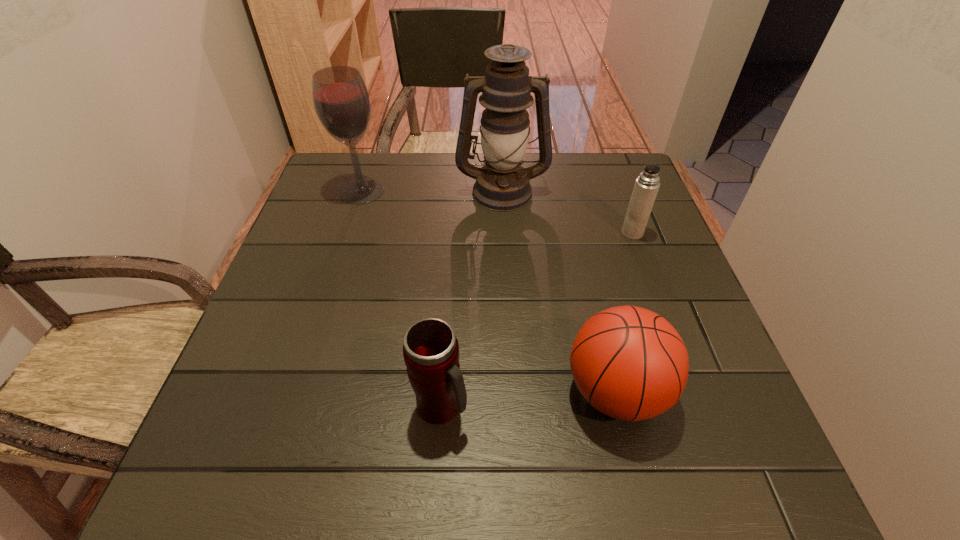
Locate an element on the screen. The height and width of the screenshot is (540, 960). oil lamp is located at coordinates (x=502, y=184).

In order to click on alcohol in this screenshot , I will do `click(341, 100)`.

The height and width of the screenshot is (540, 960). Find the location of `the leftmost object`. the leftmost object is located at coordinates (341, 100).

Identify the location of the left thermos bottle. (431, 351).

Where is `the right thermos bottle`? This screenshot has width=960, height=540. the right thermos bottle is located at coordinates tap(646, 187).

Identify the location of the farther thermos bottle. The width and height of the screenshot is (960, 540). (646, 187).

You are a GUI agent. You are given a task and a screenshot of the screen. Output one action in this format:
    pyautogui.click(x=<x>, y=<y>)
    Task: Click on the basketball
    
    Given the screenshot: What is the action you would take?
    pyautogui.click(x=629, y=363)

Image resolution: width=960 pixels, height=540 pixels. Find the location of `vacant space located on the left of the oil lamp`. vacant space located on the left of the oil lamp is located at coordinates [395, 191].

Locate an element on the screen. Image resolution: width=960 pixels, height=540 pixels. free spot located 0.300m on the right of the fourth shortest object is located at coordinates (495, 191).

Locate an element on the screen. This screenshot has height=540, width=960. free location located 0.200m on the side with the handle of the left thermos bottle is located at coordinates (584, 407).